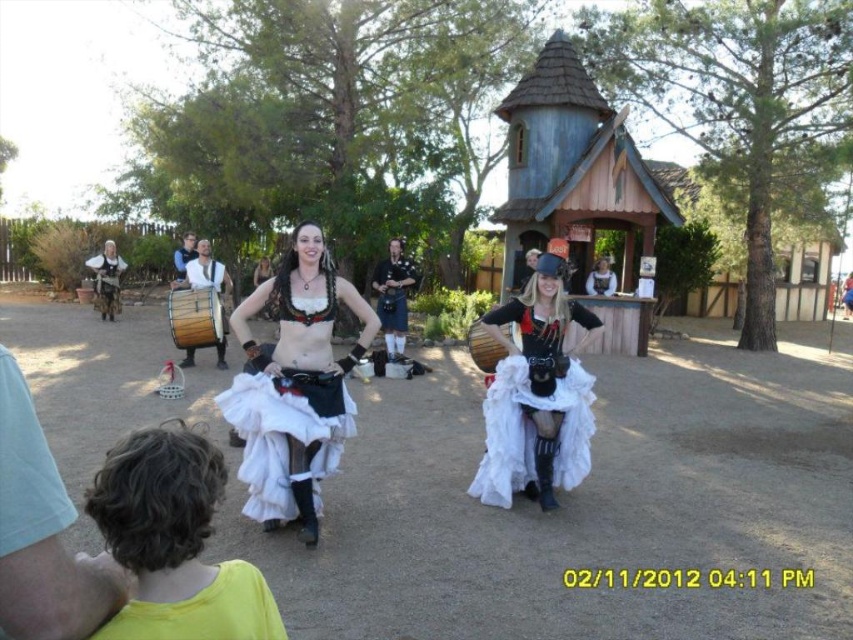
Between yellow fabric shirt at lower left and black leather kilt at center, which one appears on the left side from the viewer's perspective?

Positioned to the left is black leather kilt at center.

Which is more to the right, yellow fabric shirt at lower left or black leather kilt at center?

Positioned to the right is yellow fabric shirt at lower left.

Between point (271, 609) and point (402, 300), which one is positioned in front?

Point (271, 609) is more forward.

This screenshot has width=853, height=640. Find the location of `yellow fabric shirt at lower left`. yellow fabric shirt at lower left is located at coordinates (202, 611).

Based on the photo, between matte black drum at center and white lace dress at center, which one has more height?

Standing taller between the two is matte black drum at center.

Does matte black drum at center have a greater width compared to white lace dress at center?

Yes.

At what (x,y) coordinates should I click in order to perform the action: click on matte black drum at center. Please return your answer as a coordinate pair (x, y). Looking at the image, I should click on (107, 280).

Which is above, white lace skirt at center or matte black drum at center?

Positioned higher is matte black drum at center.

Is point (323, 369) positioned after point (111, 266)?

That is False.

In order to click on white lace skirt at center in this screenshot , I will do `click(294, 385)`.